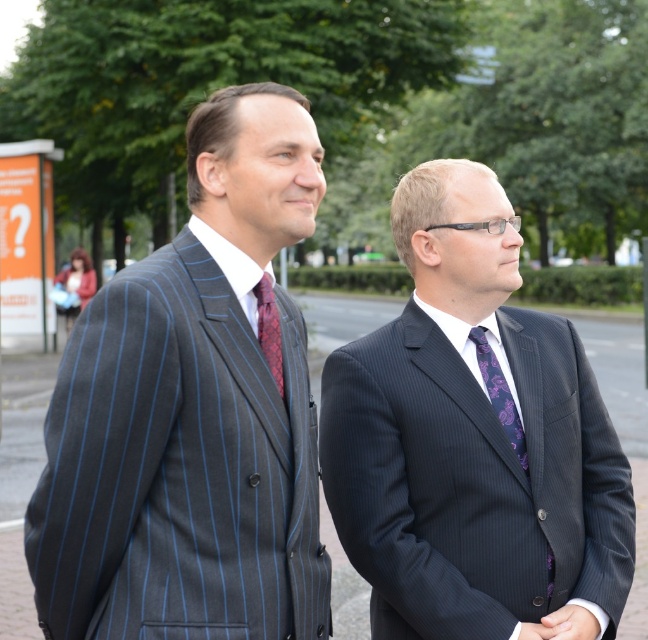
Measure the distance between purple floral fabric tie at center and camera.

They are 3.61 meters apart.

Is point (509, 417) behind point (491, 362)?

No.

The width and height of the screenshot is (648, 640). In order to click on purple floral fabric tie at center in this screenshot , I will do `click(500, 394)`.

Between dark pinstripe suit at center and purple silk tie at center, which one has more height?

dark pinstripe suit at center is taller.

Which is behind, point (505, 538) or point (518, 424)?

Point (518, 424)

Identify the location of dark pinstripe suit at center. (472, 440).

Can you confirm if purple silk tie at center is shorter than red textured tie at center?

No, purple silk tie at center is not shorter than red textured tie at center.

What do you see at coordinates (500, 394) in the screenshot?
I see `purple silk tie at center` at bounding box center [500, 394].

Find the location of a particular element. Image resolution: width=648 pixels, height=640 pixels. purple silk tie at center is located at coordinates (500, 394).